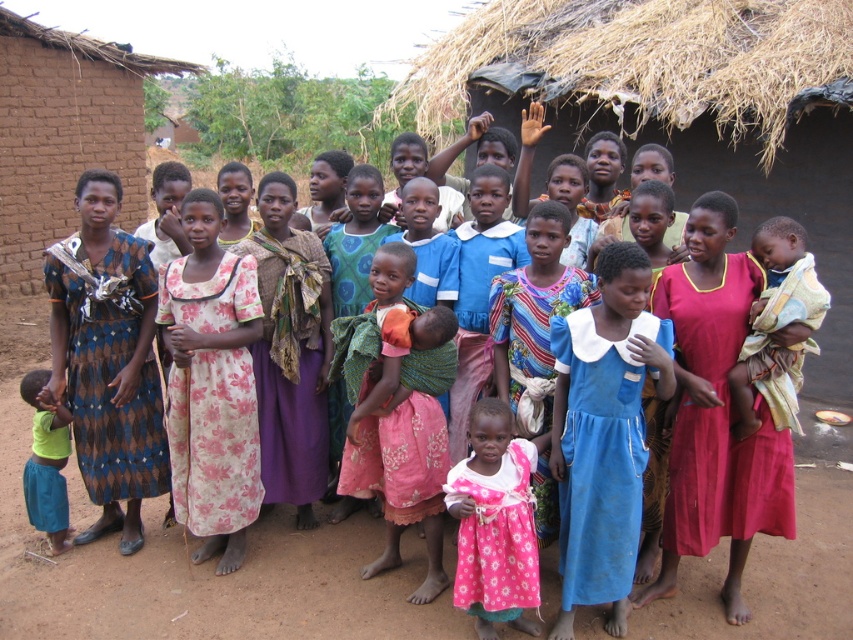
You are standing at the point with coordinates point (491, 413) and want to walk towards the point with coordinates point (634, 509). Based on the scene description, will you be moving towards the mud brick structure on the left or the thatched roof hut on the right?

Point (634, 509) is behind point (491, 413), so moving towards it would mean walking away from both the mud brick structure on the left and the thatched roof hut on the right.

You are organizing a photo shoot and need to arrange the blue cotton dress at center and the floral cotton dress at center so that one is taller than the other. Based on the scene, which dress should you place in a position to appear taller?

The floral cotton dress at center is taller than the blue cotton dress at center, so you should place the floral cotton dress at center in a position to appear taller.